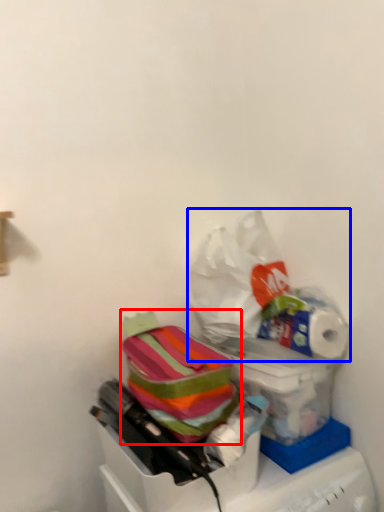
Question: Which object appears closest to the camera in this image, material (highlighted by a red box) or plastic bag (highlighted by a blue box)?

Choices:
 (A) material
 (B) plastic bag

Answer: (A)